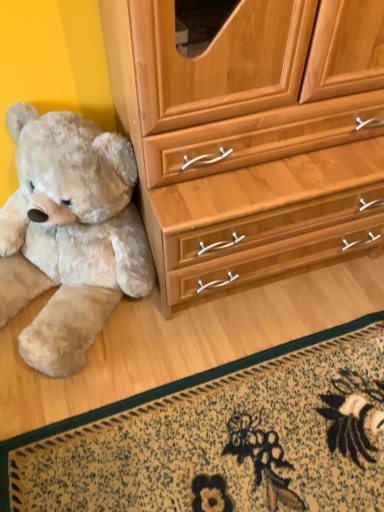
Question: Considering the relative positions of fluffy beige teddy bear at left and floral carpet at lower center in the image provided, is fluffy beige teddy bear at left to the right of floral carpet at lower center from the viewer's perspective?

Choices:
 (A) yes
 (B) no

Answer: (B)

Question: Is fluffy beige teddy bear at left closer to the viewer compared to floral carpet at lower center?

Choices:
 (A) no
 (B) yes

Answer: (B)

Question: From the image's perspective, is fluffy beige teddy bear at left located beneath floral carpet at lower center?

Choices:
 (A) no
 (B) yes

Answer: (A)

Question: From the image's perspective, is fluffy beige teddy bear at left over floral carpet at lower center?

Choices:
 (A) yes
 (B) no

Answer: (A)

Question: Does fluffy beige teddy bear at left appear on the left side of floral carpet at lower center?

Choices:
 (A) yes
 (B) no

Answer: (A)

Question: Is fluffy beige teddy bear at left thinner than floral carpet at lower center?

Choices:
 (A) no
 (B) yes

Answer: (A)

Question: Is the surface of floral carpet at lower center in direct contact with fluffy beige teddy bear at left?

Choices:
 (A) yes
 (B) no

Answer: (B)

Question: From the image's perspective, would you say floral carpet at lower center is positioned over fluffy beige teddy bear at left?

Choices:
 (A) yes
 (B) no

Answer: (B)

Question: Can you confirm if floral carpet at lower center is bigger than fluffy beige teddy bear at left?

Choices:
 (A) yes
 (B) no

Answer: (B)

Question: Considering the relative positions of floral carpet at lower center and fluffy beige teddy bear at left in the image provided, is floral carpet at lower center in front of fluffy beige teddy bear at left?

Choices:
 (A) no
 (B) yes

Answer: (A)

Question: Considering the relative sizes of floral carpet at lower center and fluffy beige teddy bear at left in the image provided, is floral carpet at lower center shorter than fluffy beige teddy bear at left?

Choices:
 (A) no
 (B) yes

Answer: (B)

Question: Is floral carpet at lower center far away from fluffy beige teddy bear at left?

Choices:
 (A) yes
 (B) no

Answer: (B)

Question: From a real-world perspective, is fluffy beige teddy bear at left above or below floral carpet at lower center?

Choices:
 (A) below
 (B) above

Answer: (B)